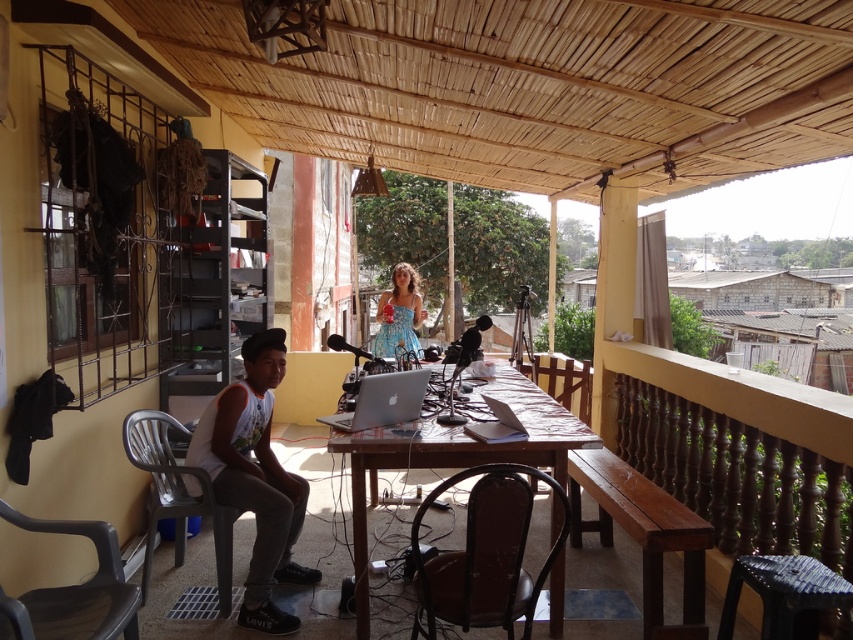
Question: Which point is closer to the camera?

Choices:
 (A) silver metallic laptop at center
 (B) wooden table at center
 (C) blue printed dress at center

Answer: (B)

Question: Which of the following is the closest to the observer?

Choices:
 (A) (383, 324)
 (B) (212, 458)
 (C) (354, 545)
 (D) (368, 417)

Answer: (C)

Question: Does wooden table at center appear on the left side of silver metallic laptop at center?

Choices:
 (A) no
 (B) yes

Answer: (A)

Question: Is silver metallic laptop at center bigger than blue printed dress at center?

Choices:
 (A) no
 (B) yes

Answer: (A)

Question: Does white plastic chair at lower left appear over wooden table at center?

Choices:
 (A) no
 (B) yes

Answer: (A)

Question: Among these objects, which one is farthest from the camera?

Choices:
 (A) wooden table at center
 (B) silver metallic laptop at center

Answer: (B)